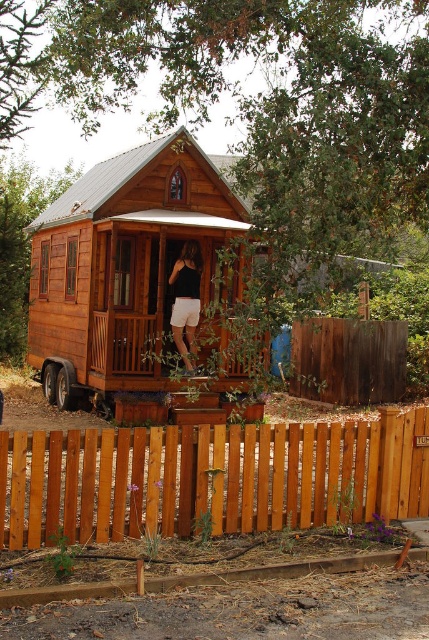
Between black cotton shorts at center and metallic silver wheel at lower left, which one is positioned higher?

black cotton shorts at center is above.

Does black cotton shorts at center have a smaller size compared to metallic silver wheel at lower left?

Actually, black cotton shorts at center might be larger than metallic silver wheel at lower left.

Find the location of a particular element. black cotton shorts at center is located at coordinates (186, 300).

Who is shorter, wooden cabin at center or wooden porch at center?

wooden porch at center

Is point (87, 289) positioned in front of point (126, 387)?

No.

Does point (76, 390) come farther from viewer compared to point (99, 349)?

Yes, point (76, 390) is behind point (99, 349).

This screenshot has width=429, height=640. I want to click on wooden cabin at center, so click(x=123, y=260).

Between point (90, 442) and point (47, 380), which one is positioned behind?

The point (47, 380) is more distant.

Is point (422, 490) farther from viewer compared to point (44, 388)?

No, it is not.

Is point (332, 481) closer to camera compared to point (48, 376)?

Yes, it is in front of point (48, 376).

At what (x,y) coordinates should I click in order to perform the action: click on wooden picket fence at center. Please return your answer as a coordinate pair (x, y). This screenshot has height=640, width=429. Looking at the image, I should click on (211, 477).